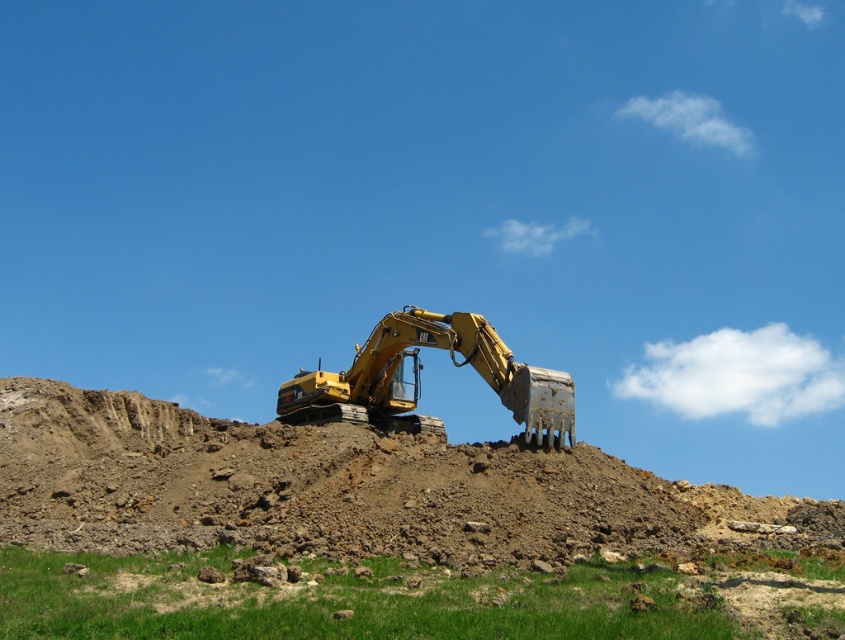
Question: Is brown dirt hill at center positioned behind green grass at lower center?

Choices:
 (A) yes
 (B) no

Answer: (A)

Question: Is green grass at lower center wider than matte yellow excavator at center?

Choices:
 (A) yes
 (B) no

Answer: (A)

Question: Among these points, which one is farthest from the camera?

Choices:
 (A) (404, 458)
 (B) (488, 374)
 (C) (352, 632)

Answer: (B)

Question: Which of the following is the farthest from the observer?

Choices:
 (A) green grass at lower center
 (B) brown dirt hill at center
 (C) matte yellow excavator at center

Answer: (C)

Question: Does green grass at lower center appear over matte yellow excavator at center?

Choices:
 (A) yes
 (B) no

Answer: (B)

Question: Which of the following is the farthest from the observer?

Choices:
 (A) matte yellow excavator at center
 (B) green grass at lower center
 (C) brown dirt hill at center

Answer: (A)